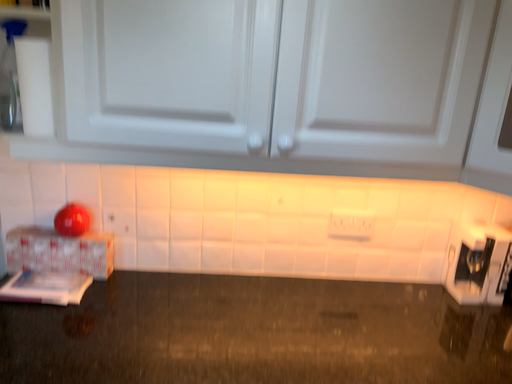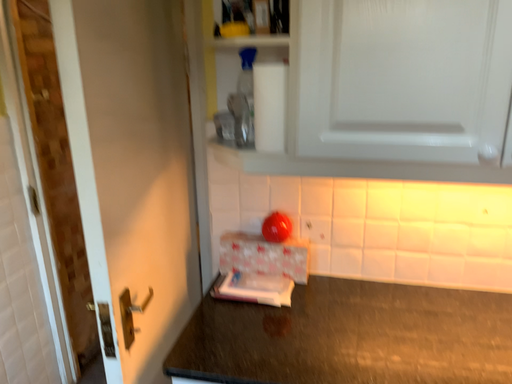
Question: Which way did the camera rotate in the video?

Choices:
 (A) rotated right
 (B) rotated left

Answer: (B)